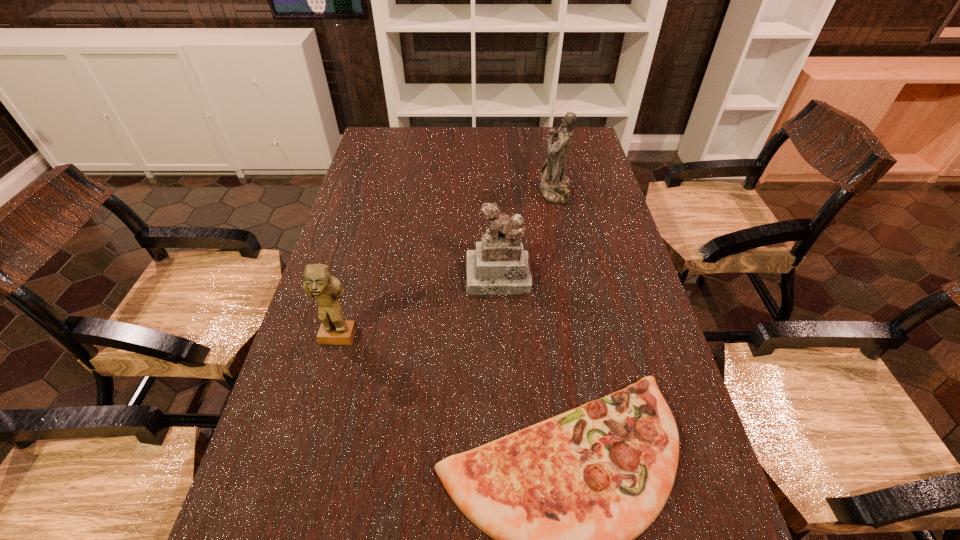
Find the location of a particular element. The image size is (960, 540). free point located 0.070m on the front-facing side of the leftmost figurine is located at coordinates (328, 374).

Where is `object situated at the left edge`? Image resolution: width=960 pixels, height=540 pixels. object situated at the left edge is located at coordinates (318, 283).

The height and width of the screenshot is (540, 960). Find the location of `object located in the right edge section of the desktop`. object located in the right edge section of the desktop is located at coordinates (554, 185).

Image resolution: width=960 pixels, height=540 pixels. In the image, there is a desktop. Find the location of `free region at the far edge`. free region at the far edge is located at coordinates [x=455, y=138].

In the image, there is a desktop. Where is `vacant space at the left edge`? vacant space at the left edge is located at coordinates (x=323, y=528).

Locate an element on the screen. This screenshot has height=540, width=960. vacant space at the right edge of the desktop is located at coordinates (573, 183).

The width and height of the screenshot is (960, 540). Identify the location of blank space at the far left corner. (410, 132).

This screenshot has width=960, height=540. I want to click on free space at the far right corner of the desktop, so click(580, 156).

Where is `free space between the leftmost figurine and the second figurine from left to right`? Image resolution: width=960 pixels, height=540 pixels. free space between the leftmost figurine and the second figurine from left to right is located at coordinates (419, 307).

Locate an element on the screen. free space between the nearest figurine and the rightmost figurine is located at coordinates (446, 265).